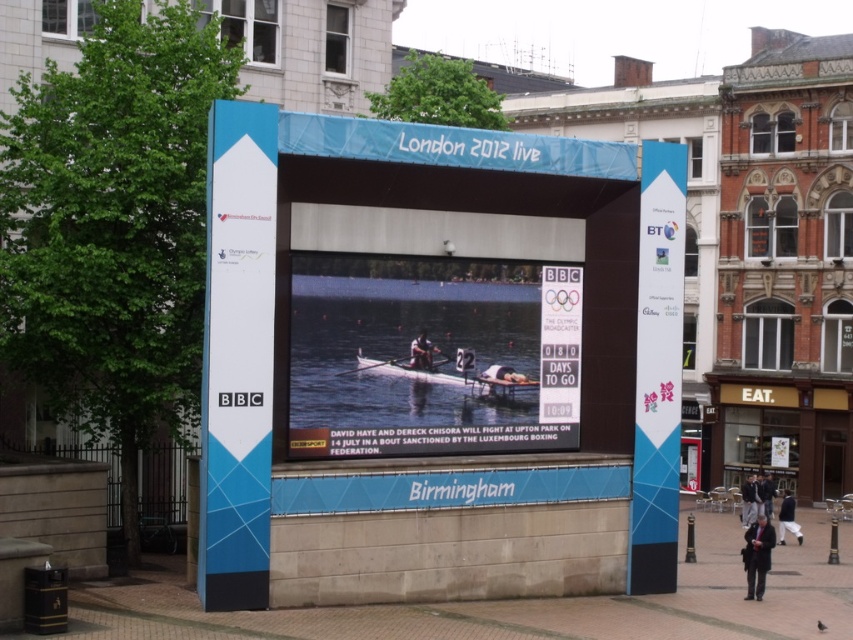
Is matte black rowing boat at center smaller than white glossy boat at center?

Indeed, matte black rowing boat at center has a smaller size compared to white glossy boat at center.

In the scene shown: Is matte black rowing boat at center below white glossy boat at center?

Indeed, matte black rowing boat at center is positioned under white glossy boat at center.

The image size is (853, 640). What are the coordinates of `matte black rowing boat at center` in the screenshot? It's located at (433, 356).

Is point (409, 422) in front of point (761, 516)?

That is True.

What do you see at coordinates (433, 356) in the screenshot?
I see `matte black rowing boat at center` at bounding box center [433, 356].

You are a GUI agent. You are given a task and a screenshot of the screen. Output one action in this format:
    pyautogui.click(x=<x>, y=<y>)
    Task: Click on the matte black rowing boat at center
    The height and width of the screenshot is (640, 853).
    Given the screenshot: What is the action you would take?
    pyautogui.click(x=433, y=356)

Does blue plastic sign at right come in front of dark blue jacket at lower right?

Yes, it is in front of dark blue jacket at lower right.

Does point (676, 301) lie in front of point (770, 496)?

That is True.

Which is behind, point (665, 384) or point (762, 476)?

The point (762, 476) is more distant.

Image resolution: width=853 pixels, height=640 pixels. Identify the location of blue plastic sign at right. (657, 371).